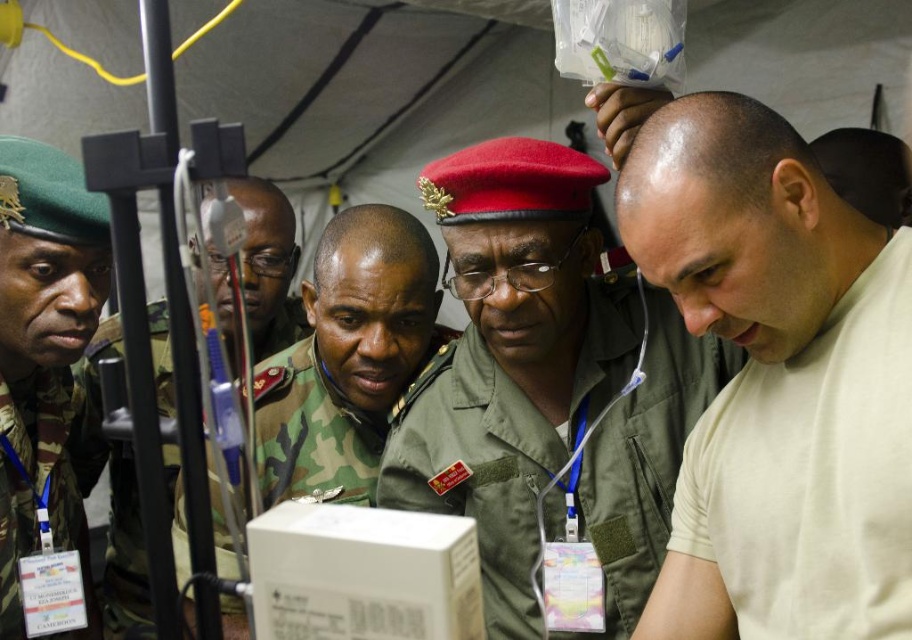
Question: Which point is closer to the camera?

Choices:
 (A) (375, 310)
 (B) (3, 189)
 (C) (586, 397)
 (D) (89, 611)

Answer: (B)

Question: Is green uniform at center above beige cotton shirt at center?

Choices:
 (A) no
 (B) yes

Answer: (A)

Question: Can you confirm if beige cotton shirt at center is wider than camo uniform at left?

Choices:
 (A) no
 (B) yes

Answer: (A)

Question: Does beige cotton shirt at center appear over camo uniform at left?

Choices:
 (A) yes
 (B) no

Answer: (A)

Question: Considering the real-world distances, which object is closest to the camouflage fabric uniform at left?

Choices:
 (A) camo uniform at left
 (B) camouflage uniform at center
 (C) camouflage uniform at left
 (D) green uniform at center

Answer: (C)

Question: Among these points, which one is nearest to the camera?

Choices:
 (A) (44, 518)
 (B) (60, 420)

Answer: (A)